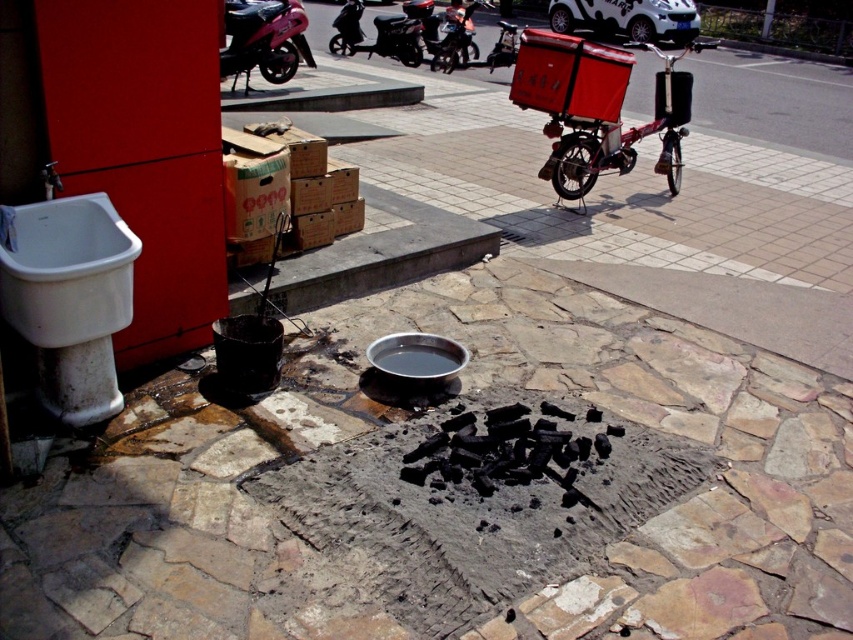
You are standing in the middle of the smooth stone pavement at center and want to move towards the metallic pink motorcycle at upper left. Which direction should you walk to get closer to the motorcycle?

Since the smooth stone pavement at center is closer to the viewer than the metallic pink motorcycle at upper left, you should walk forward towards the motorcycle to get closer to it.

You are a delivery person who needs to park your motorcycle in a spot near the white matte sink at lower left. Considering the size of the metallic pink motorcycle at upper left and the sink, will the motorcycle fit in the space next to the sink?

The white matte sink at lower left has a smaller size compared to the metallic pink motorcycle at upper left. Since the sink is smaller, the space next to it may not be sufficient to accommodate the larger motorcycle.

You are standing at the center of the stone area where the cooking setup is located. You need to move the metallic pink motorcycle at upper left to the white sink on the left side of the frame. Can you directly move it there without moving any other objects?

The metallic pink motorcycle at upper left is located at point [264,38]. Since the sink is on the left side of the frame and the motorcycle is at upper left, it might already be near the sink area. However, without knowing the exact positions of other objects, it is uncertain if a direct path is clear.